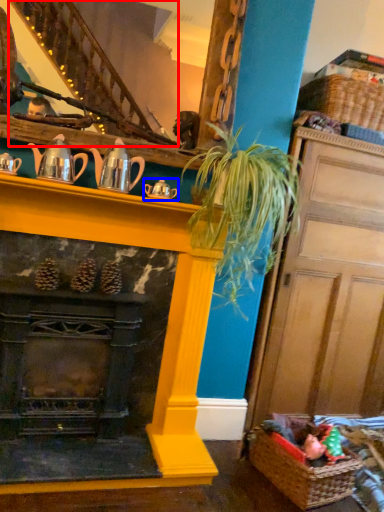
Question: Among these objects, which one is nearest to the camera, stairwell (highlighted by a red box) or tea pot (highlighted by a blue box)?

Choices:
 (A) stairwell
 (B) tea pot

Answer: (A)